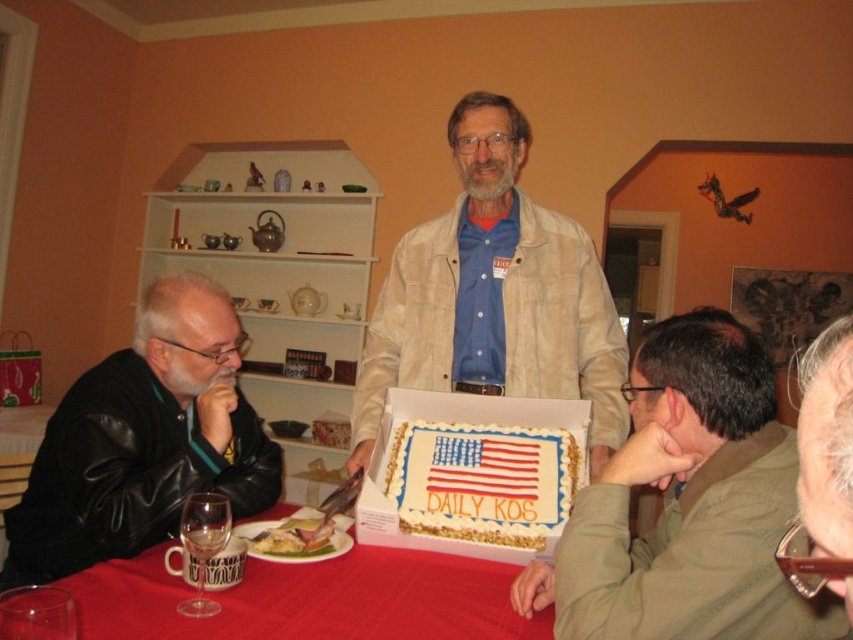
You are at a party and want to grab the white frosted cake with american flag design at center. There is a light beige jacket at center in the way. Which direction should you move to reach the cake?

The light beige jacket at center is to the right of the white frosted cake with american flag design at center, so you should move to the left to reach the cake.

You are a guest at the party and want to grab the white frosted cake with american flag design at center. The light beige jacket at center is blocking your path. Can you reach the cake without moving the jacket?

The distance between the light beige jacket at center and white frosted cake with american flag design at center is 11.96 inches. Since the jacket is blocking your path, you would need to move it to reach the cake unless you can extend your arm or utensil to the cake without disturbing the jacket.

You are a guest at the party and want to take a photo of the white frosted cake with american flag design at center. However, there is a light beige jacket at center blocking your view. Can you estimate whether the jacket is wider than the cake?

The light beige jacket at center is wider than the white frosted cake with american flag design at center, so the jacket is blocking the view of the cake and you cannot take a clear photo.